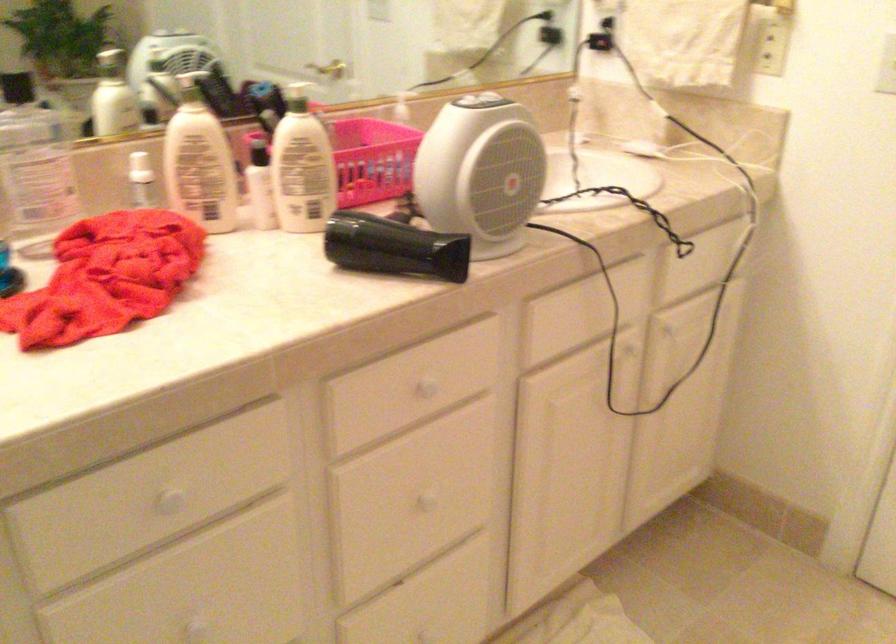
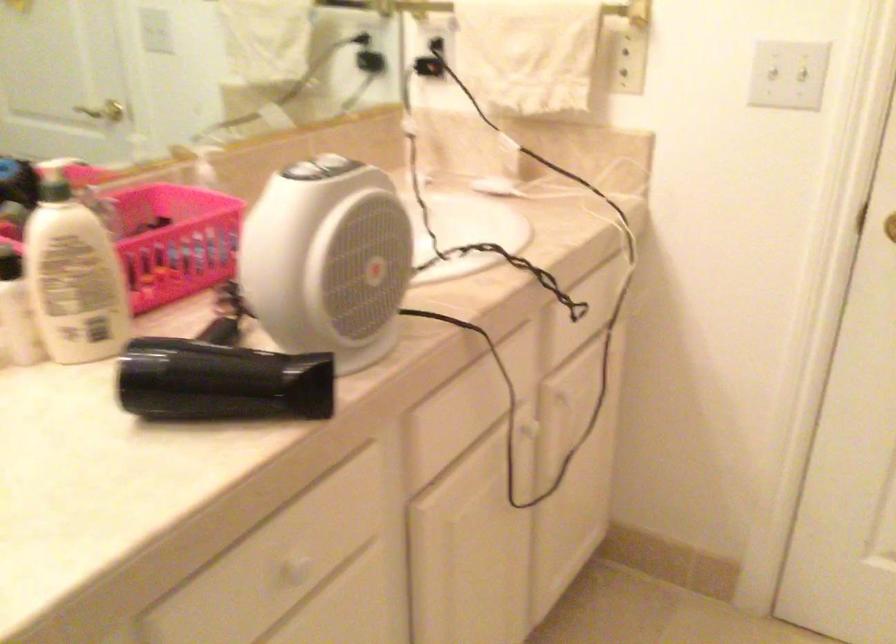
Question: What movement of the cameraman would produce the second image?

Choices:
 (A) Left
 (B) Right
 (C) Forward
 (D) Backward

Answer: (C)